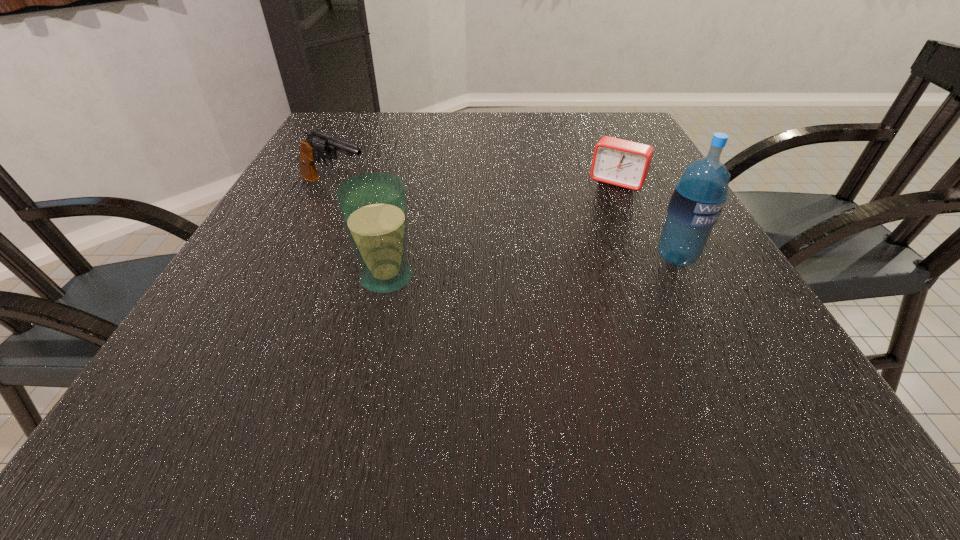
You are a GUI agent. You are given a task and a screenshot of the screen. Output one action in this format:
    pyautogui.click(x=<x>, y=<y>)
    Task: Click on the free space located 0.120m on the front-facing side of the alarm clock
    This screenshot has height=540, width=960.
    Given the screenshot: What is the action you would take?
    pyautogui.click(x=590, y=218)

Locate an element on the screen. This screenshot has width=960, height=540. vacant space located along the barrel of the third tallest object is located at coordinates point(489,247).

Identify the location of blank space located along the barrel of the third tallest object. The image size is (960, 540). (497, 251).

You are a GUI agent. You are given a task and a screenshot of the screen. Output one action in this format:
    pyautogui.click(x=<x>, y=<y>)
    Task: Click on the vacant space situated 0.130m along the barrel of the third tallest object
    
    Given the screenshot: What is the action you would take?
    pyautogui.click(x=409, y=214)

At what (x,y) coordinates should I click in order to perform the action: click on object that is at the left edge. Please return your answer as a coordinate pair (x, y). The height and width of the screenshot is (540, 960). Looking at the image, I should click on (318, 144).

The image size is (960, 540). Identify the location of water bottle at the right edge. (698, 197).

Where is `alarm clock that is at the right edge`? alarm clock that is at the right edge is located at coordinates (618, 162).

I want to click on free space at the far edge, so (x=406, y=116).

Find the location of `vacant space at the left edge of the desktop`. vacant space at the left edge of the desktop is located at coordinates (332, 184).

You are a GUI agent. You are given a task and a screenshot of the screen. Output one action in this format:
    pyautogui.click(x=<x>, y=<y>)
    Task: Click on the free location at the right edge
    Image resolution: width=960 pixels, height=540 pixels.
    Given the screenshot: What is the action you would take?
    pyautogui.click(x=647, y=191)